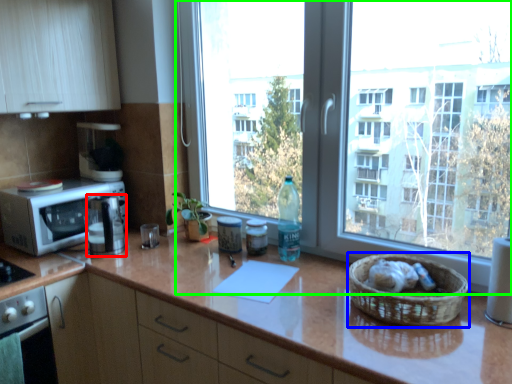
Question: Which is nearer to the coffee machine (highlighted by a red box)? basket (highlighted by a blue box) or window (highlighted by a green box).

Choices:
 (A) basket
 (B) window

Answer: (B)